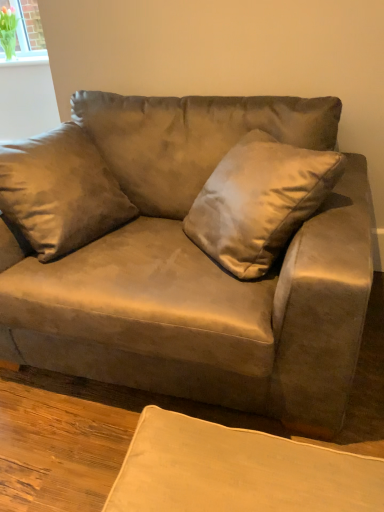
Question: Could suede couch at center be considered to be inside satin gold pillow at center?

Choices:
 (A) no
 (B) yes

Answer: (A)

Question: Is satin gold pillow at center touching suede couch at center?

Choices:
 (A) no
 (B) yes

Answer: (A)

Question: Is satin gold pillow at center closer to the viewer compared to suede couch at center?

Choices:
 (A) yes
 (B) no

Answer: (B)

Question: Considering the relative sizes of satin gold pillow at center and suede couch at center in the image provided, is satin gold pillow at center bigger than suede couch at center?

Choices:
 (A) no
 (B) yes

Answer: (A)

Question: Is satin gold pillow at center aimed at suede couch at center?

Choices:
 (A) yes
 (B) no

Answer: (A)

Question: In the image, is suede couch at center positioned in front of or behind clear glass vase at upper left?

Choices:
 (A) front
 (B) behind

Answer: (A)

Question: Looking at their shapes, would you say suede couch at center is wider or thinner than clear glass vase at upper left?

Choices:
 (A) wide
 (B) thin

Answer: (A)

Question: From the image's perspective, is suede couch at center located above or below clear glass vase at upper left?

Choices:
 (A) above
 (B) below

Answer: (B)

Question: Is suede couch at center taller or shorter than clear glass vase at upper left?

Choices:
 (A) short
 (B) tall

Answer: (B)

Question: From a real-world perspective, relative to suede couch at center, is satin gold pillow at center vertically above or below?

Choices:
 (A) above
 (B) below

Answer: (A)

Question: Would you say satin gold pillow at center is to the left or to the right of suede couch at center in the picture?

Choices:
 (A) right
 (B) left

Answer: (A)

Question: Which is correct: satin gold pillow at center is inside suede couch at center, or outside of it?

Choices:
 (A) inside
 (B) outside

Answer: (A)

Question: From the image's perspective, relative to suede couch at center, is satin gold pillow at center above or below?

Choices:
 (A) below
 (B) above

Answer: (B)

Question: Relative to satin gold pillow at center, is clear glass vase at upper left in front or behind?

Choices:
 (A) behind
 (B) front

Answer: (A)

Question: From the image's perspective, is clear glass vase at upper left positioned above or below satin gold pillow at center?

Choices:
 (A) above
 (B) below

Answer: (A)